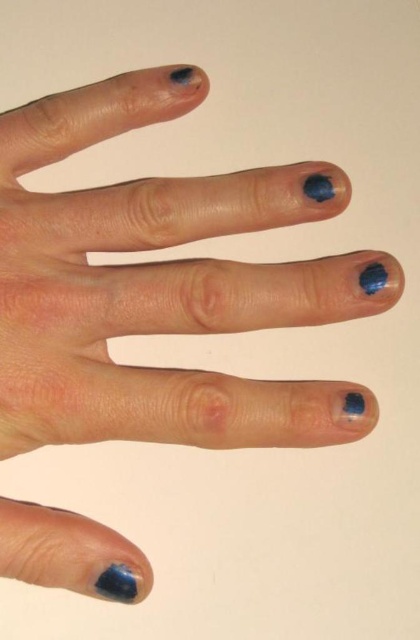
Question: Can you confirm if matte blue nail polish at lower left is smaller than matte blue nail polish at upper right?

Choices:
 (A) no
 (B) yes

Answer: (A)

Question: Which of the following is the farthest from the observer?

Choices:
 (A) (380, 269)
 (B) (112, 588)
 (C) (315, 193)

Answer: (C)

Question: Which point is farther to the camera?

Choices:
 (A) (104, 586)
 (B) (309, 188)
 (C) (367, 273)
 (D) (344, 408)

Answer: (B)

Question: Is matte blue nail polish at lower left above matte blue nail polish at lower right?

Choices:
 (A) yes
 (B) no

Answer: (B)

Question: Among these points, which one is farthest from the camera?

Choices:
 (A) (319, 198)
 (B) (362, 282)

Answer: (A)

Question: Can you confirm if matte blue nail polish at upper center is positioned below matte blue nail polish at upper right?

Choices:
 (A) yes
 (B) no

Answer: (B)